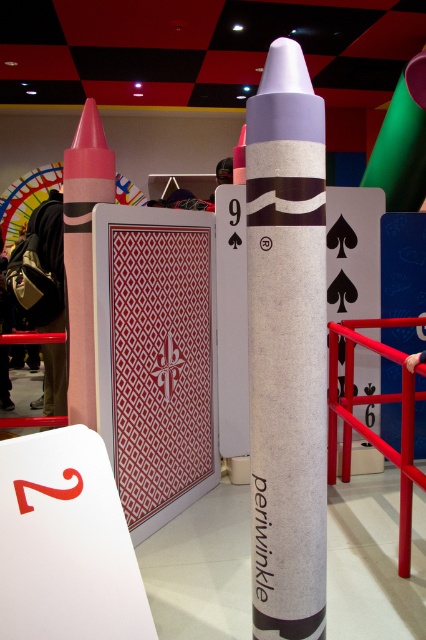
Which is behind, point (291, 387) or point (108, 150)?

The point (108, 150) is behind.

Measure the distance between matte paper crayon at center and matte pink crayon at left.

matte paper crayon at center and matte pink crayon at left are 3.51 feet apart.

Find the location of a particular element. This screenshot has width=426, height=640. matte paper crayon at center is located at coordinates (287, 348).

Where is `matte paper crayon at center`? Image resolution: width=426 pixels, height=640 pixels. matte paper crayon at center is located at coordinates (x=287, y=348).